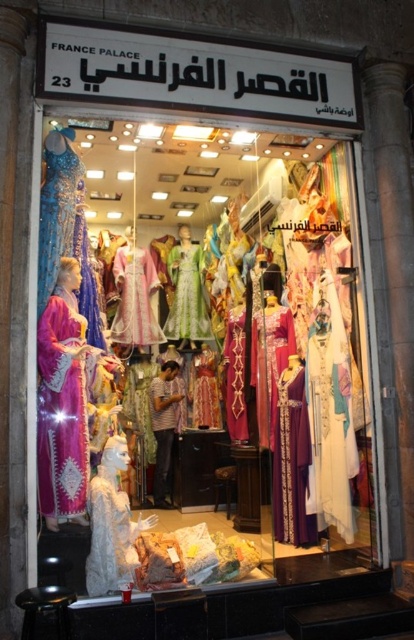
Describe the element at coordinates (65, 228) in the screenshot. This screenshot has width=414, height=640. I see `shiny blue fabric dress at left` at that location.

Is shiny blue fabric dress at left behind green lace dress at center?

That is False.

The image size is (414, 640). Identify the location of shiny blue fabric dress at left. (65, 228).

Who is more distant from viewer, (260, 524) or (67, 256)?

Positioned behind is point (260, 524).

This screenshot has width=414, height=640. What do you see at coordinates (243, 308) in the screenshot? I see `matte purple dress at center` at bounding box center [243, 308].

Who is more distant from viewer, (134, 397) or (96, 326)?

The point (134, 397) is behind.

The height and width of the screenshot is (640, 414). I want to click on matte purple dress at center, so click(243, 308).

Does matte purple dress at center have a lesser height compared to black leather stool at lower left?

No.

Does matte purple dress at center have a larger size compared to black leather stool at lower left?

Correct, matte purple dress at center is larger in size than black leather stool at lower left.

Does point (305, 308) lie behind point (21, 595)?

Yes, it is.

Find the location of a particular element. matte purple dress at center is located at coordinates (243, 308).